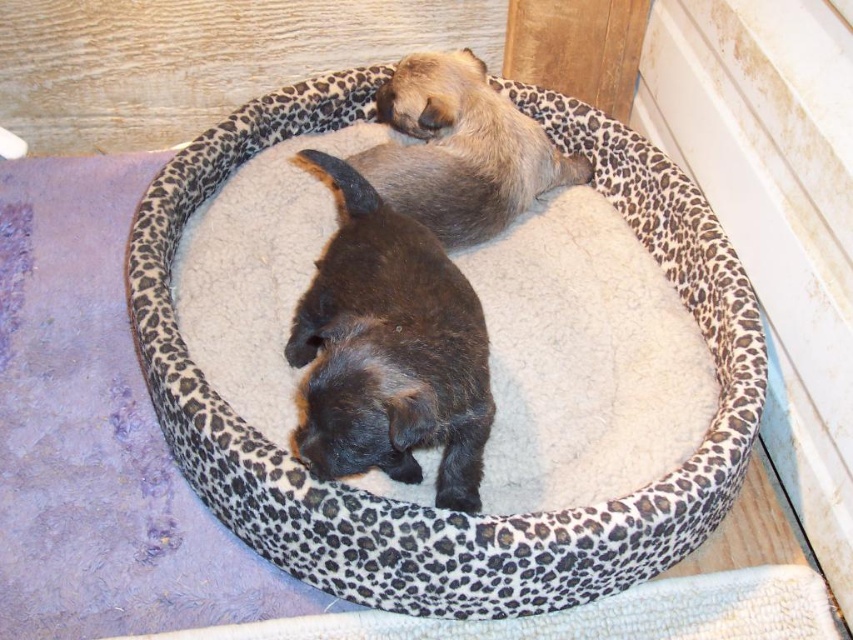
Does leopard print fabric cat bed at center have a lesser height compared to black fur dog at center?

In fact, leopard print fabric cat bed at center may be taller than black fur dog at center.

Is leopard print fabric cat bed at center bigger than black fur dog at center?

Yes.

Between point (669, 541) and point (460, 476), which one is positioned behind?

Positioned behind is point (460, 476).

Where is `leopard print fabric cat bed at center`? Image resolution: width=853 pixels, height=640 pixels. leopard print fabric cat bed at center is located at coordinates (413, 502).

Is leopard print fabric cat bed at center taller than fuzzy beige dog at upper center?

Yes.

Is leopard print fabric cat bed at center positioned at the back of fuzzy beige dog at upper center?

That is False.

Who is more forward, (164, 369) or (527, 156)?

Positioned in front is point (164, 369).

The height and width of the screenshot is (640, 853). Find the location of `leopard print fabric cat bed at center`. leopard print fabric cat bed at center is located at coordinates (413, 502).

Is black fur dog at center behind fuzzy beige dog at upper center?

No, it is in front of fuzzy beige dog at upper center.

Looking at this image, which is more to the right, black fur dog at center or fuzzy beige dog at upper center?

From the viewer's perspective, fuzzy beige dog at upper center appears more on the right side.

Identify the location of black fur dog at center. The width and height of the screenshot is (853, 640). (389, 349).